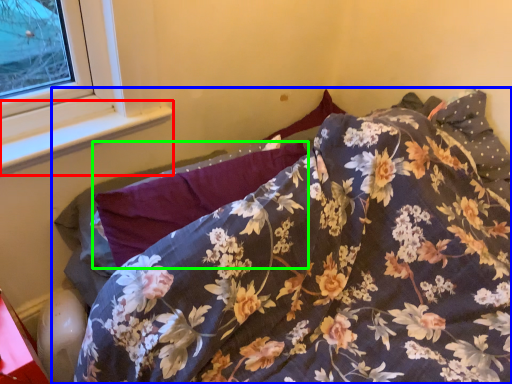
Question: Estimate the real-world distances between objects in this image. Which object is closer to window sill (highlighted by a red box), bed (highlighted by a blue box) or pillow (highlighted by a green box)?

Choices:
 (A) bed
 (B) pillow

Answer: (B)